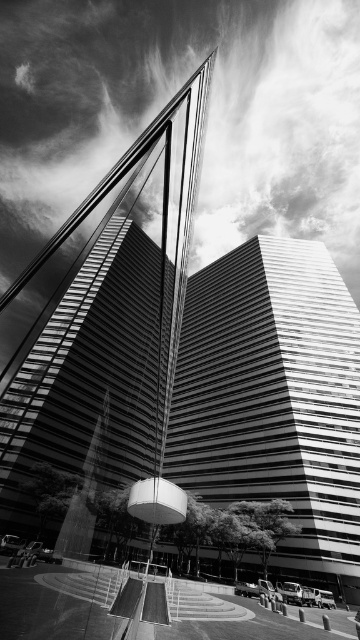
Is smooth glass skyscraper at center thinner than smooth glass tower at center?

Incorrect, smooth glass skyscraper at center's width is not less than smooth glass tower at center's.

Which is in front, point (177, 307) or point (209, 333)?

Point (177, 307) is more forward.

Which is in front, point (182, 227) or point (348, 353)?

Point (182, 227)

Identify the location of smooth glass skyscraper at center. (101, 328).